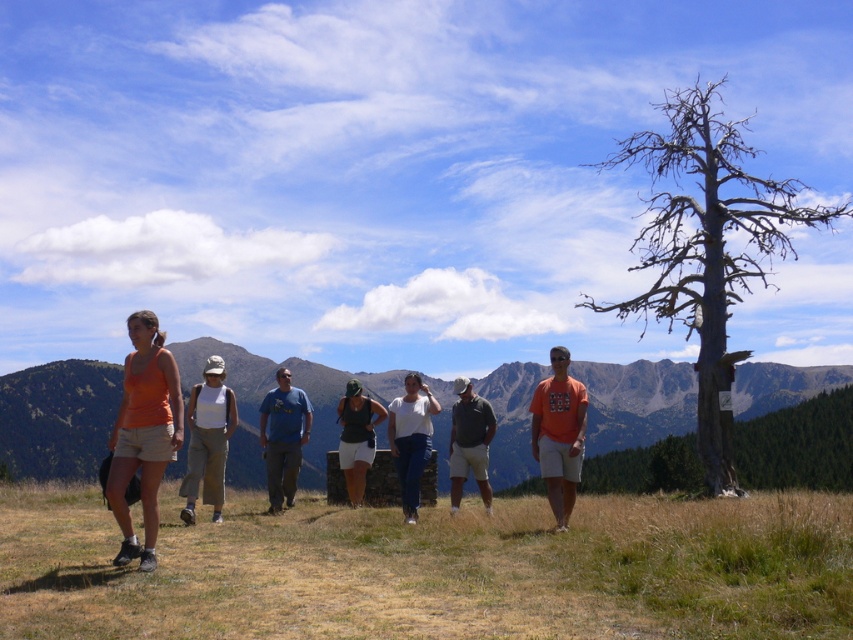
Question: Estimate the real-world distances between objects in this image. Which object is closer to the matte black tank top at center?

Choices:
 (A) dry grass at lower center
 (B) orange cotton tank top at left
 (C) green grassy mountain at center

Answer: (A)

Question: Estimate the real-world distances between objects in this image. Which object is closer to the matte black tank top at center?

Choices:
 (A) orange cotton tank top at left
 (B) blue cotton shirt at center
 (C) dry grass at lower center

Answer: (B)

Question: Is orange cotton tank top at left behind orange cotton t-shirt at center?

Choices:
 (A) no
 (B) yes

Answer: (A)

Question: Can you confirm if orange cotton t-shirt at center is wider than matte black tank top at center?

Choices:
 (A) yes
 (B) no

Answer: (B)

Question: Can you confirm if white cotton shirt at center is bigger than blue cotton shirt at center?

Choices:
 (A) no
 (B) yes

Answer: (B)

Question: Which of the following is the farthest from the observer?

Choices:
 (A) [184, 509]
 (B) [643, 552]
 (C) [483, 456]

Answer: (C)